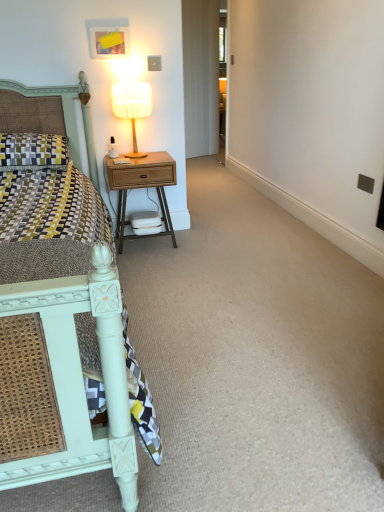
Question: Considering the relative sizes of patterned fabric pillow at left and white fabric lampshade at upper right in the image provided, is patterned fabric pillow at left shorter than white fabric lampshade at upper right?

Choices:
 (A) yes
 (B) no

Answer: (A)

Question: Could you tell me if patterned fabric pillow at left is turned towards white fabric lampshade at upper right?

Choices:
 (A) no
 (B) yes

Answer: (A)

Question: Is patterned fabric pillow at left positioned in front of white fabric lampshade at upper right?

Choices:
 (A) no
 (B) yes

Answer: (B)

Question: Is white fabric lampshade at upper right at the back of patterned fabric pillow at left?

Choices:
 (A) yes
 (B) no

Answer: (B)

Question: Is patterned fabric pillow at left far from white fabric lampshade at upper right?

Choices:
 (A) yes
 (B) no

Answer: (B)

Question: From a real-world perspective, is patterned fabric pillow at left positioned over white fabric lampshade at upper right based on gravity?

Choices:
 (A) no
 (B) yes

Answer: (A)

Question: Does patterned fabric pillow at left have a larger size compared to matte white bed at left?

Choices:
 (A) no
 (B) yes

Answer: (A)

Question: From the image's perspective, is patterned fabric pillow at left above matte white bed at left?

Choices:
 (A) no
 (B) yes

Answer: (B)

Question: Is patterned fabric pillow at left positioned in front of matte white bed at left?

Choices:
 (A) no
 (B) yes

Answer: (A)

Question: Can you confirm if patterned fabric pillow at left is positioned to the right of matte white bed at left?

Choices:
 (A) yes
 (B) no

Answer: (B)

Question: Is patterned fabric pillow at left at the left side of matte white bed at left?

Choices:
 (A) yes
 (B) no

Answer: (A)

Question: Can you confirm if patterned fabric pillow at left is taller than matte white bed at left?

Choices:
 (A) no
 (B) yes

Answer: (A)

Question: From the image's perspective, is white fabric lampshade at upper right beneath patterned fabric pillow at left?

Choices:
 (A) no
 (B) yes

Answer: (A)